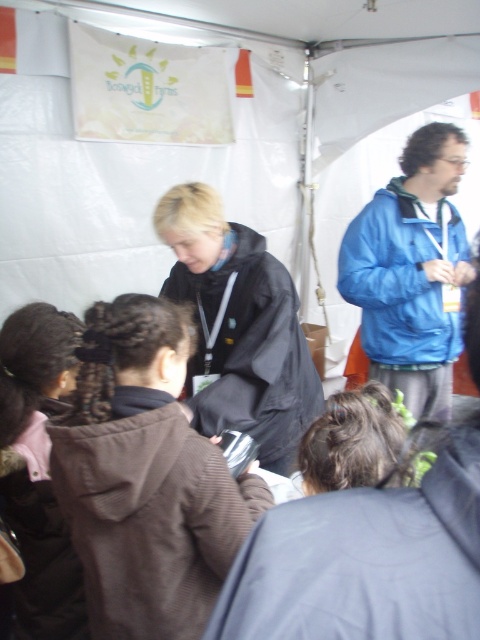
Question: Which of the following is the closest to the observer?

Choices:
 (A) (340, 417)
 (B) (39, 612)
 (C) (354, 282)
 (D) (280, 376)

Answer: (A)

Question: Can you confirm if brown fuzzy jacket at center is positioned above blue jacket at upper right?

Choices:
 (A) no
 (B) yes

Answer: (A)

Question: Which point is farther to the camera?

Choices:
 (A) tap(8, 456)
 (B) tap(452, 307)
 (C) tap(169, 234)

Answer: (B)

Question: Can you confirm if brown fuzzy jacket at center is bigger than black matte jacket at center?

Choices:
 (A) no
 (B) yes

Answer: (A)

Question: Considering the real-world distances, which object is closest to the brown fuzzy jacket at center?

Choices:
 (A) black matte jacket at center
 (B) blue jacket at upper right
 (C) brown fuzzy jacket at lower left
 (D) dark brown hair at center

Answer: (D)

Question: Can you confirm if black matte jacket at center is positioned above brown fuzzy jacket at lower left?

Choices:
 (A) yes
 (B) no

Answer: (A)